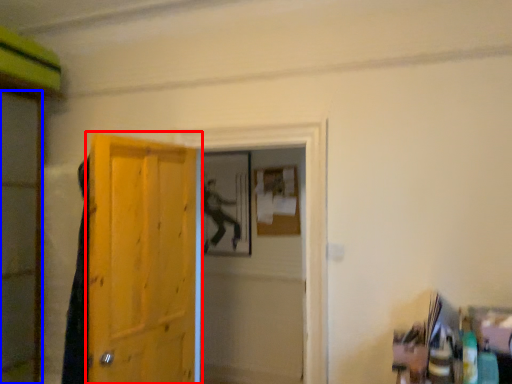
Question: Among these objects, which one is farthest to the camera, door (highlighted by a red box) or screen door (highlighted by a blue box)?

Choices:
 (A) door
 (B) screen door

Answer: (B)